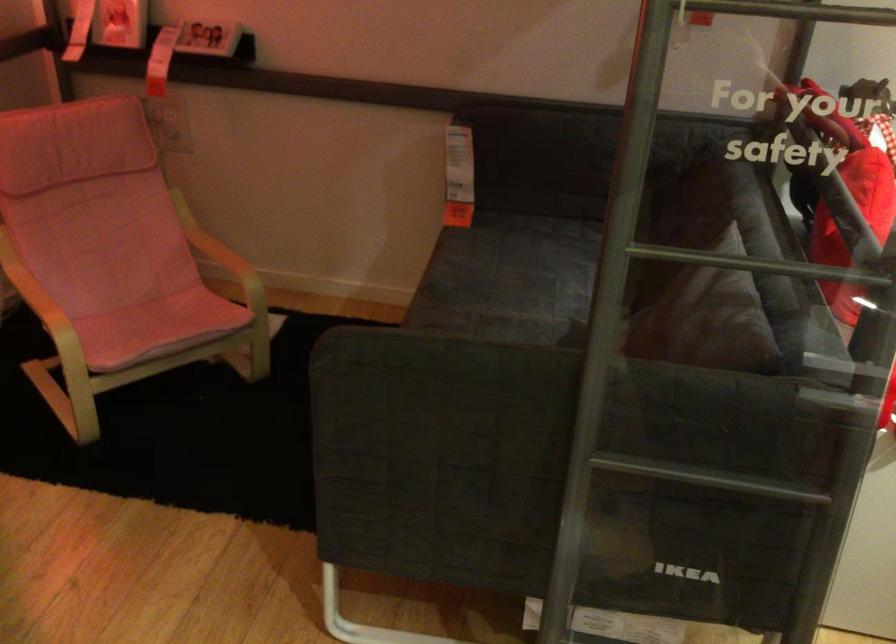
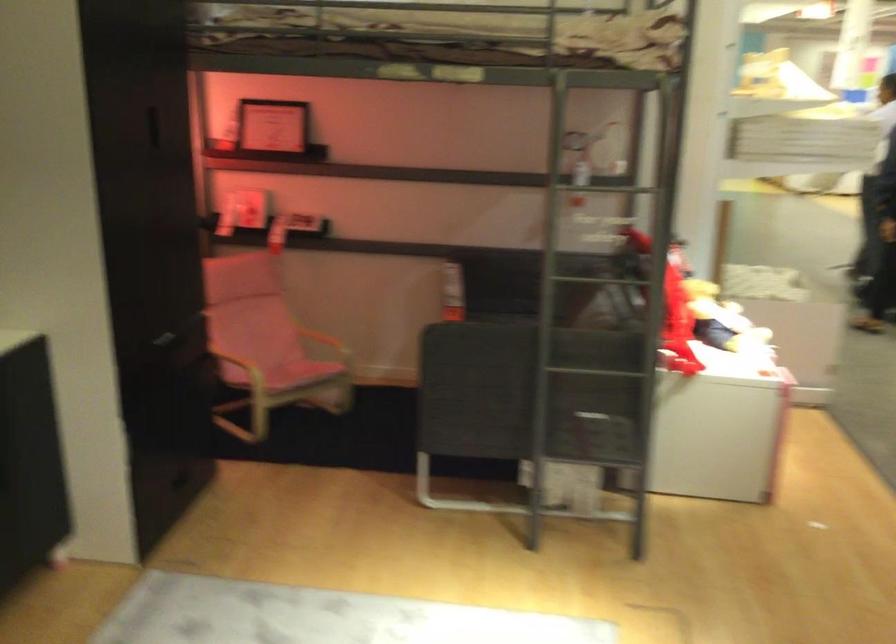
Where in the second image is the point corresponding to (122,276) from the first image?

(268, 353)